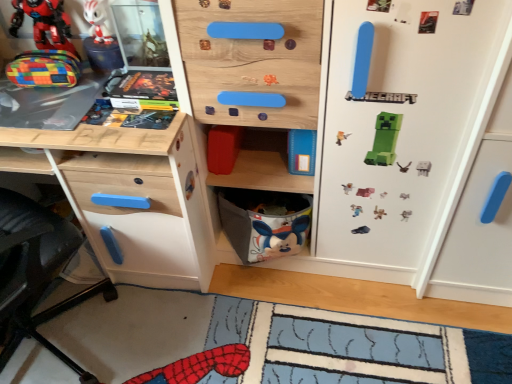
Question: Is gray fabric basket at lower center not inside wooden board game at upper left?

Choices:
 (A) no
 (B) yes

Answer: (B)

Question: Does gray fabric basket at lower center have a lesser width compared to wooden board game at upper left?

Choices:
 (A) no
 (B) yes

Answer: (A)

Question: From the image's perspective, is gray fabric basket at lower center beneath wooden board game at upper left?

Choices:
 (A) no
 (B) yes

Answer: (B)

Question: Is gray fabric basket at lower center bigger than wooden board game at upper left?

Choices:
 (A) yes
 (B) no

Answer: (A)

Question: Can you confirm if gray fabric basket at lower center is positioned to the right of wooden board game at upper left?

Choices:
 (A) no
 (B) yes

Answer: (B)

Question: Would you say wooden board game at upper left is part of gray fabric basket at lower center's contents?

Choices:
 (A) yes
 (B) no

Answer: (B)

Question: Considering the relative sizes of white glossy figurine at upper left, placed as the 1th toy when sorted from top to bottom, and gray fabric basket at lower center in the image provided, is white glossy figurine at upper left, placed as the 1th toy when sorted from top to bottom, wider than gray fabric basket at lower center?

Choices:
 (A) no
 (B) yes

Answer: (A)

Question: From a real-world perspective, does white glossy figurine at upper left, marked as the third toy in a bottom-to-top arrangement, stand above gray fabric basket at lower center?

Choices:
 (A) yes
 (B) no

Answer: (A)

Question: Considering the relative sizes of white glossy figurine at upper left, placed as the 1th toy when sorted from top to bottom, and gray fabric basket at lower center in the image provided, is white glossy figurine at upper left, placed as the 1th toy when sorted from top to bottom, taller than gray fabric basket at lower center?

Choices:
 (A) no
 (B) yes

Answer: (A)

Question: Does white glossy figurine at upper left, marked as the third toy in a bottom-to-top arrangement, come behind gray fabric basket at lower center?

Choices:
 (A) yes
 (B) no

Answer: (B)

Question: Is white glossy figurine at upper left, marked as the third toy in a bottom-to-top arrangement, thinner than gray fabric basket at lower center?

Choices:
 (A) no
 (B) yes

Answer: (B)

Question: Are white glossy figurine at upper left, placed as the 1th toy when sorted from top to bottom, and gray fabric basket at lower center beside each other?

Choices:
 (A) yes
 (B) no

Answer: (B)

Question: Can gray fabric basket at lower center be found inside white matte fridge at center?

Choices:
 (A) yes
 (B) no

Answer: (A)